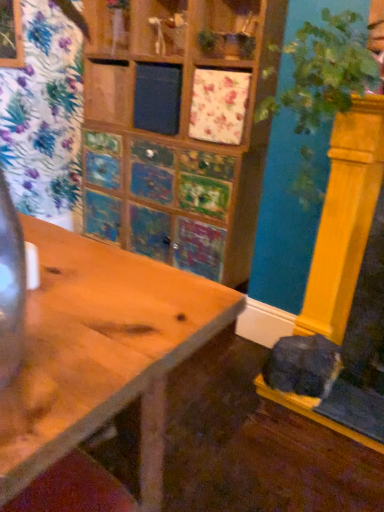
What do you see at coordinates (101, 351) in the screenshot? The image size is (384, 512). I see `wooden table at center` at bounding box center [101, 351].

What do you see at coordinates (324, 71) in the screenshot?
I see `green leafy plant at right` at bounding box center [324, 71].

At what (x,y) coordinates should I click in order to perform the action: click on soft gray fur cat at lower right. Please return your answer as a coordinate pair (x, y). This screenshot has height=512, width=384. Looking at the image, I should click on (303, 366).

Is green leafy plant at right bigger than soft gray fur cat at lower right?

Indeed, green leafy plant at right has a larger size compared to soft gray fur cat at lower right.

Is point (317, 103) less distant than point (304, 389)?

That is True.

Can you confirm if green leafy plant at right is shorter than soft gray fur cat at lower right?

No.

Which object is closer to the camera taking this photo, green leafy plant at right or soft gray fur cat at lower right?

green leafy plant at right is closer to the camera.

From the image's perspective, is soft gray fur cat at lower right below green leafy plant at right?

Indeed, from the image's perspective, soft gray fur cat at lower right is shown beneath green leafy plant at right.

From a real-world perspective, is soft gray fur cat at lower right located higher than green leafy plant at right?

No, from a real-world perspective, soft gray fur cat at lower right is not above green leafy plant at right.

Find the location of a particular element. animal below the green leafy plant at right (from a real-world perspective) is located at coordinates (303, 366).

Considering the relative sizes of green leafy plant at right and wooden table at center in the image provided, is green leafy plant at right shorter than wooden table at center?

No, green leafy plant at right is not shorter than wooden table at center.

From the image's perspective, is green leafy plant at right beneath wooden table at center?

No, from the image's perspective, green leafy plant at right is not beneath wooden table at center.

Which is closer to the camera, [328,53] or [3,484]?

The point [3,484] is in front.

In the scene shown: From a real-world perspective, which is physically above, green leafy plant at right or wooden table at center?

green leafy plant at right, from a real-world perspective.

From the image's perspective, which one is positioned higher, wooden table at center or green leafy plant at right?

green leafy plant at right.

Which object is closer to the camera, wooden table at center or green leafy plant at right?

wooden table at center is in front.

Is wooden table at center in contact with green leafy plant at right?

No, wooden table at center is not next to green leafy plant at right.

Between wooden table at center and green leafy plant at right, which one has smaller size?

wooden table at center is smaller.

Is wooden table at center oriented towards soft gray fur cat at lower right?

No, wooden table at center is not oriented towards soft gray fur cat at lower right.

From the image's perspective, would you say wooden table at center is shown under soft gray fur cat at lower right?

No.

Can you confirm if wooden table at center is shorter than soft gray fur cat at lower right?

Incorrect, the height of wooden table at center does not fall short of that of soft gray fur cat at lower right.

Does point (11, 390) lie in front of point (341, 358)?

Yes, point (11, 390) is closer to viewer.

From a real-world perspective, is soft gray fur cat at lower right above or below wooden table at center?

soft gray fur cat at lower right is below wooden table at center.

Is soft gray fur cat at lower right shorter than wooden table at center?

Yes, soft gray fur cat at lower right is shorter than wooden table at center.

Is soft gray fur cat at lower right looking in the opposite direction of wooden table at center?

soft gray fur cat at lower right does not have its back to wooden table at center.

From the image's perspective, which one is positioned higher, soft gray fur cat at lower right or wooden table at center?

wooden table at center appears higher in the image.

In order to click on plant on the left of the soft gray fur cat at lower right in this screenshot , I will do `click(324, 71)`.

Where is `animal below the green leafy plant at right (from a real-world perspective)`? animal below the green leafy plant at right (from a real-world perspective) is located at coordinates (303, 366).

When comparing their distances from green leafy plant at right, does soft gray fur cat at lower right or wooden table at center seem closer?

wooden table at center is positioned closer to the anchor green leafy plant at right.

Which object lies nearer to the anchor point wooden table at center, soft gray fur cat at lower right or green leafy plant at right?

green leafy plant at right is positioned closer to the anchor wooden table at center.

Looking at the image, which one is located further to soft gray fur cat at lower right, green leafy plant at right or wooden table at center?

The object further to soft gray fur cat at lower right is wooden table at center.

Which object lies further to the anchor point soft gray fur cat at lower right, wooden table at center or green leafy plant at right?

The object further to soft gray fur cat at lower right is wooden table at center.

Looking at the image, which one is located closer to wooden table at center, green leafy plant at right or soft gray fur cat at lower right?

green leafy plant at right.

Considering their positions, is wooden table at center positioned further to green leafy plant at right than soft gray fur cat at lower right?

soft gray fur cat at lower right is positioned further to the anchor green leafy plant at right.

Where is `plant located between wooden table at center and soft gray fur cat at lower right in the depth direction`? plant located between wooden table at center and soft gray fur cat at lower right in the depth direction is located at coordinates (324, 71).